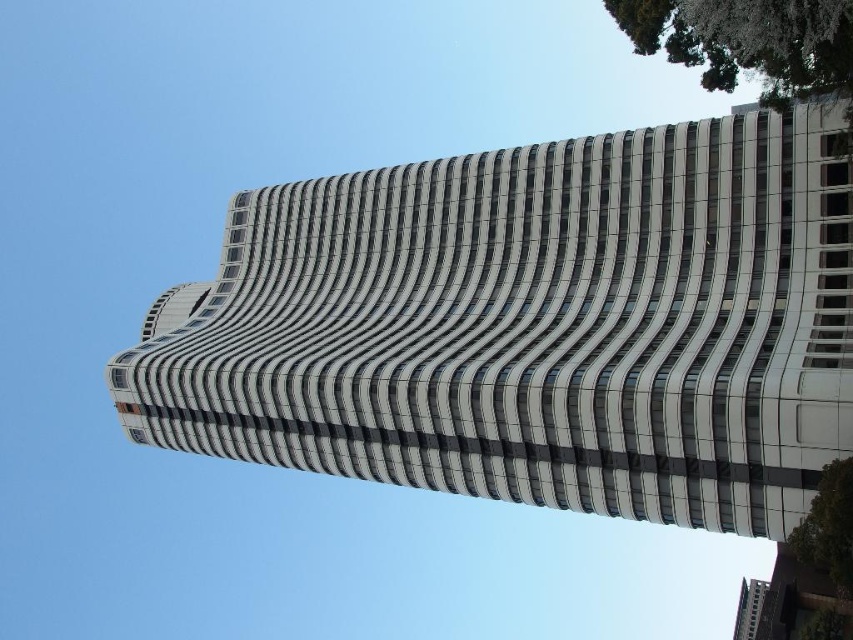
Question: Which point is farther to the camera?

Choices:
 (A) green leafy tree at lower right
 (B) white smooth building at center
 (C) green leafy tree at upper right

Answer: (B)

Question: Can you confirm if white smooth building at center is positioned to the right of green leafy tree at upper right?

Choices:
 (A) yes
 (B) no

Answer: (B)

Question: Can you confirm if white smooth building at center is positioned to the left of green leafy tree at lower right?

Choices:
 (A) no
 (B) yes

Answer: (B)

Question: Is white smooth building at center bigger than green leafy tree at upper right?

Choices:
 (A) yes
 (B) no

Answer: (A)

Question: Which point is farther to the camera?

Choices:
 (A) green leafy tree at lower right
 (B) white smooth building at center
 (C) green leafy tree at upper right

Answer: (B)

Question: Which point is closer to the camera taking this photo?

Choices:
 (A) (846, 589)
 (B) (846, 33)

Answer: (B)